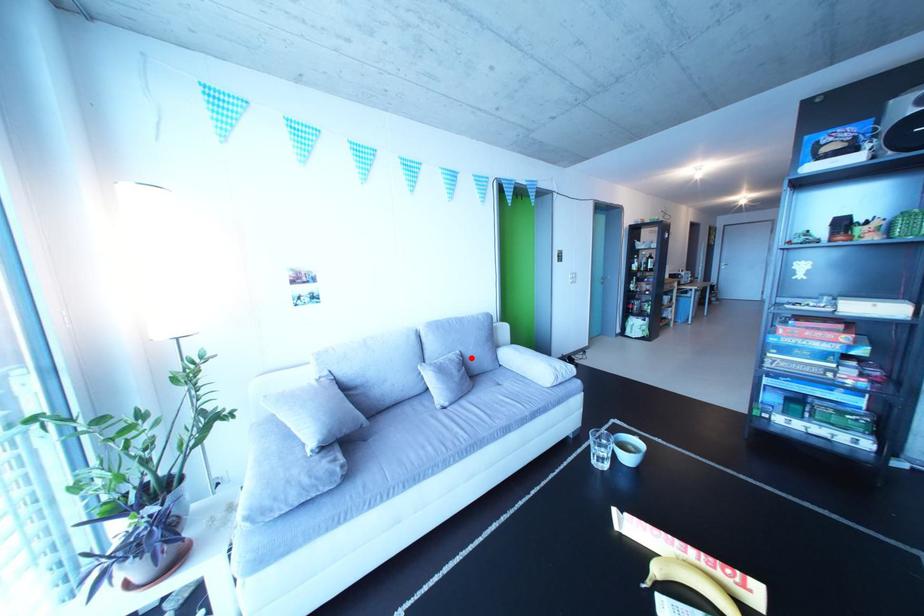
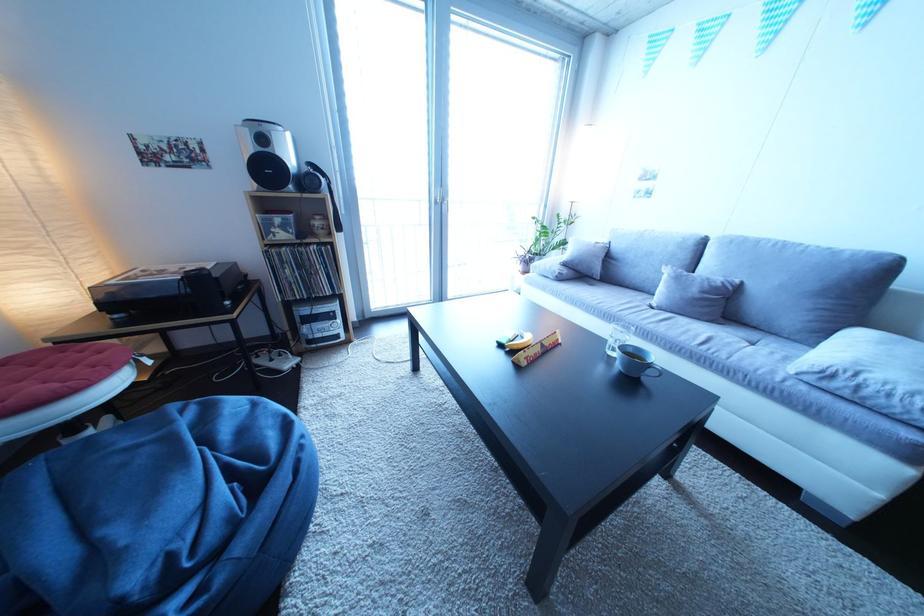
The point at the highlighted location is marked in the first image. Where is the corresponding point in the second image?

(750, 286)